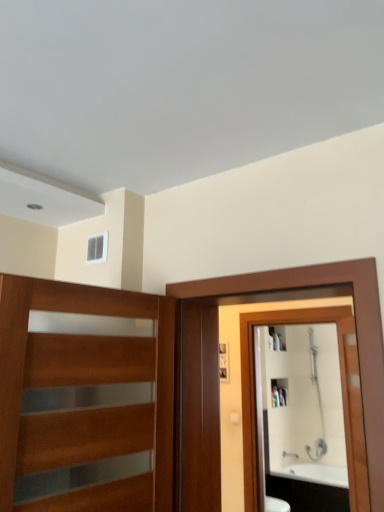
Question: Should I look upward or downward to see silver metallic faucet at lower right?

Choices:
 (A) down
 (B) up

Answer: (A)

Question: Is white glossy mirror at right smaller than wooden with glass panels at left?

Choices:
 (A) yes
 (B) no

Answer: (B)

Question: Is white glossy mirror at right positioned beyond the bounds of wooden with glass panels at left?

Choices:
 (A) no
 (B) yes

Answer: (B)

Question: Considering the relative sizes of white glossy mirror at right and wooden with glass panels at left in the image provided, is white glossy mirror at right wider than wooden with glass panels at left?

Choices:
 (A) no
 (B) yes

Answer: (B)

Question: Is white glossy mirror at right bigger than wooden with glass panels at left?

Choices:
 (A) yes
 (B) no

Answer: (A)

Question: From the image's perspective, is white glossy mirror at right over wooden with glass panels at left?

Choices:
 (A) yes
 (B) no

Answer: (B)

Question: Is white glossy mirror at right aimed at wooden with glass panels at left?

Choices:
 (A) no
 (B) yes

Answer: (B)

Question: Is brown wooden screen door at right oriented away from wooden with glass panels at left?

Choices:
 (A) yes
 (B) no

Answer: (B)

Question: Is brown wooden screen door at right wider than wooden with glass panels at left?

Choices:
 (A) yes
 (B) no

Answer: (A)

Question: Can you confirm if brown wooden screen door at right is shorter than wooden with glass panels at left?

Choices:
 (A) yes
 (B) no

Answer: (B)

Question: Is brown wooden screen door at right in contact with wooden with glass panels at left?

Choices:
 (A) yes
 (B) no

Answer: (B)

Question: Is brown wooden screen door at right in front of wooden with glass panels at left?

Choices:
 (A) no
 (B) yes

Answer: (A)

Question: From a real-world perspective, is brown wooden screen door at right located higher than wooden with glass panels at left?

Choices:
 (A) yes
 (B) no

Answer: (B)

Question: From a real-world perspective, is brown wooden screen door at right over white glossy mirror at right?

Choices:
 (A) yes
 (B) no

Answer: (A)